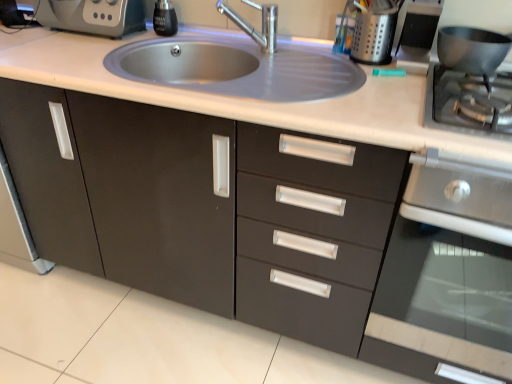
This screenshot has height=384, width=512. I want to click on vacant space to the right of black glass soap dispenser at upper center, so click(x=201, y=38).